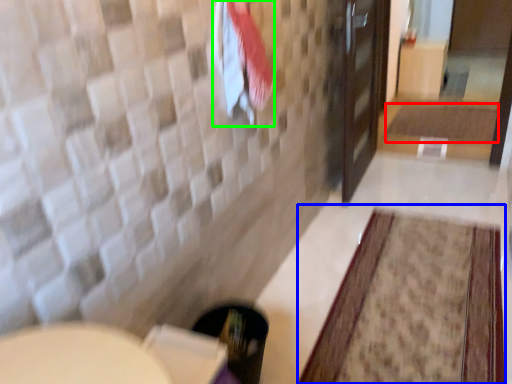
Question: Which object is positioned farthest from bath mat (highlighted by a red box)? Select from bath mat (highlighted by a blue box) and beach towel (highlighted by a green box).

Choices:
 (A) bath mat
 (B) beach towel

Answer: (B)